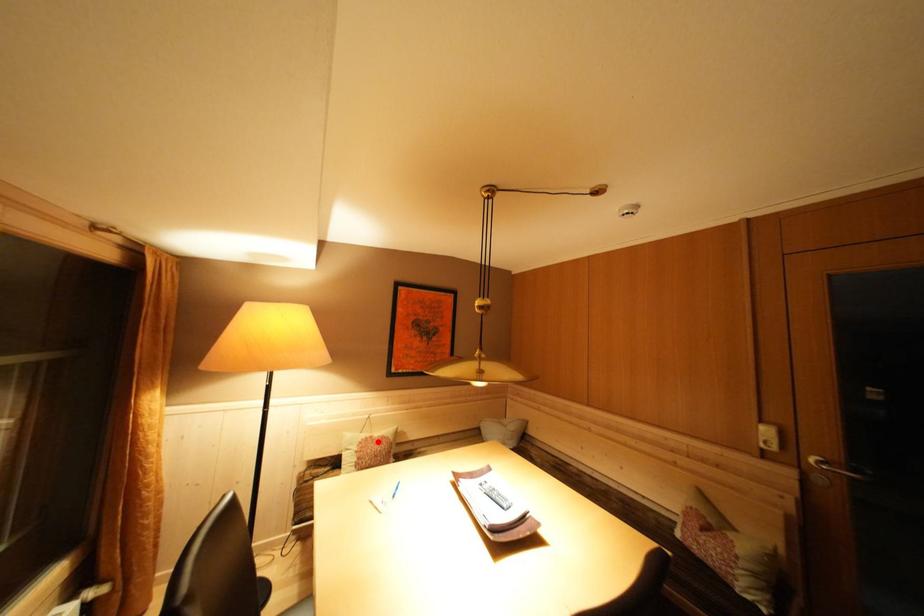
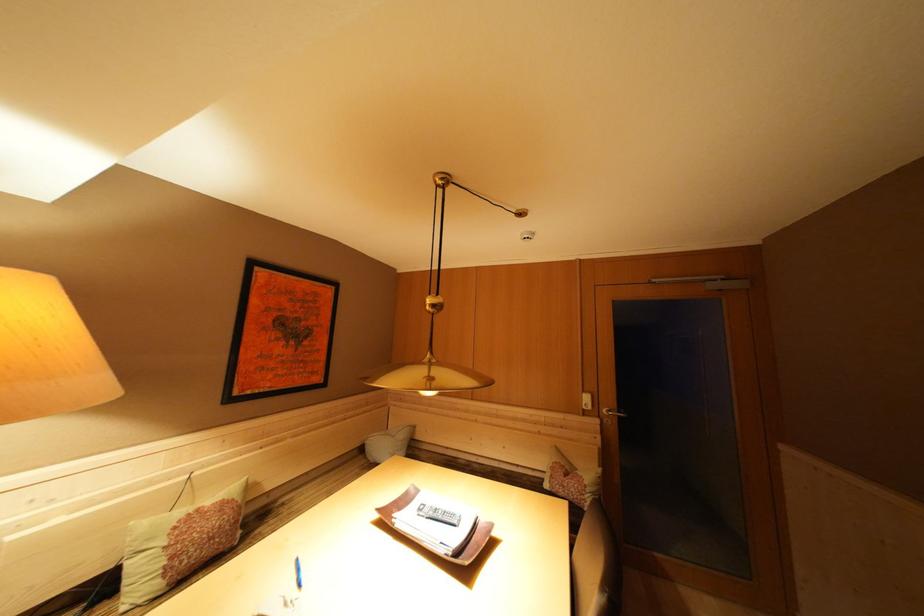
Question: I am providing you with two images of the same scene from different viewpoints. A red point is shown in image1. For the corresponding object point in image2, is it positioned nearer or farther from the camera?

Choices:
 (A) Nearer
 (B) Farther

Answer: (A)